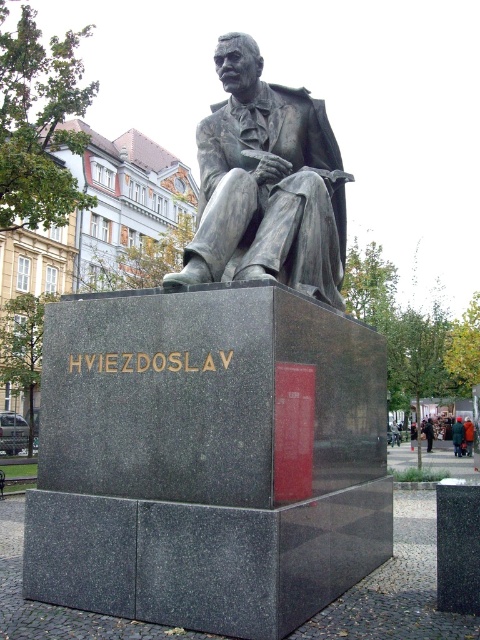
You are an art student analyzing the statue of Hviezdoslav. You notice the polished bronze statue at center and the dark gray suit at center. Which object is bigger in size?

The polished bronze statue at center is larger in size compared to the dark gray suit at center according to the description.

You are standing in front of the statue of Hviezdoslav in the park. You want to take a photo of the statue and the inscription on the pedestal. However, you notice a point at coordinates point [224,86] that is 15.26 meters away from you. Is this point likely part of the statue or the pedestal?

The point at coordinates point [224,86] is 15.26 meters away from the camera. Since the statue is mounted on a pedestal and the inscription is on the pedestal, the point is likely part of the pedestal as it is farther away compared to the statue itself.

You are an art student analyzing the statue in the park. You notice two statues at the center. Which one is narrower in width between the bronze statue at center and the matte gray statue at center?

The bronze statue at center has a lesser width compared to matte gray statue at center, so the bronze statue at center is narrower.